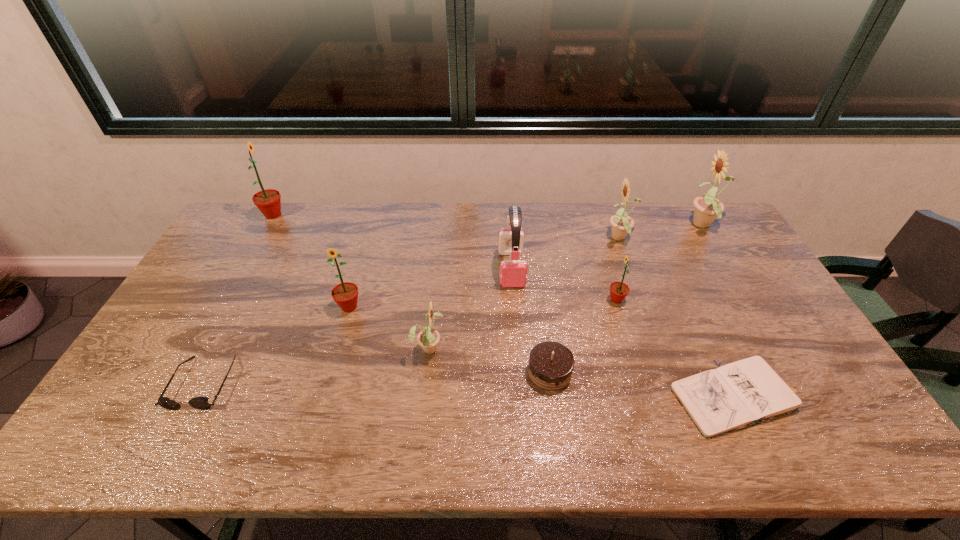
Find the location of `free point located on the front-facing side of the second smallest yellow sunflower`. free point located on the front-facing side of the second smallest yellow sunflower is located at coordinates (511, 239).

Locate an element on the screen. The image size is (960, 540). vacant area located 0.240m on the front-facing side of the second smallest yellow sunflower is located at coordinates (537, 239).

At what (x,y) coordinates should I click in order to perform the action: click on free spot located 0.400m on the front-facing side of the second smallest yellow sunflower. Please return your answer as a coordinate pair (x, y). Image resolution: width=960 pixels, height=540 pixels. Looking at the image, I should click on (492, 239).

The width and height of the screenshot is (960, 540). Find the location of `vacant area situated on the face of the fifth sunflower from right to left`. vacant area situated on the face of the fifth sunflower from right to left is located at coordinates (338, 347).

You are a GUI agent. You are given a task and a screenshot of the screen. Output one action in this format:
    pyautogui.click(x=<x>, y=<y>)
    Task: Click on the free space located 0.290m on the outer surface of the pink earphone
    
    Given the screenshot: What is the action you would take?
    pyautogui.click(x=519, y=366)

I want to click on free region located 0.350m on the front-facing side of the nearest sunflower, so click(570, 347).

The image size is (960, 540). What are the coordinates of `blank area located on the face of the smallest green sunflower` in the screenshot? It's located at (545, 300).

Where is `free spot located 0.250m on the face of the smallest green sunflower`? free spot located 0.250m on the face of the smallest green sunflower is located at coordinates (525, 300).

Where is `vacant space located on the face of the smallest green sunflower`? The height and width of the screenshot is (540, 960). vacant space located on the face of the smallest green sunflower is located at coordinates (509, 300).

Locate an element on the screen. This screenshot has height=540, width=960. vacant space located 0.390m on the left of the eighth tallest object is located at coordinates (380, 372).